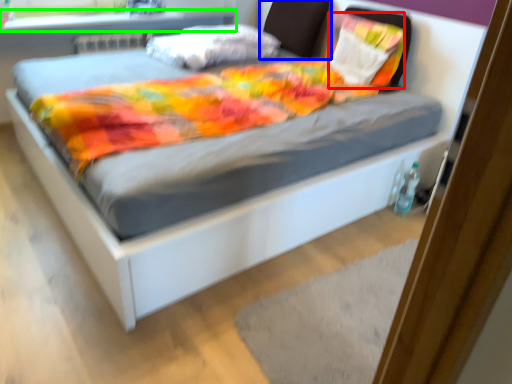
Question: Estimate the real-world distances between objects in this image. Which object is closer to pillow (highlighted by a red box), headboard (highlighted by a blue box) or window sill (highlighted by a green box)?

Choices:
 (A) headboard
 (B) window sill

Answer: (A)